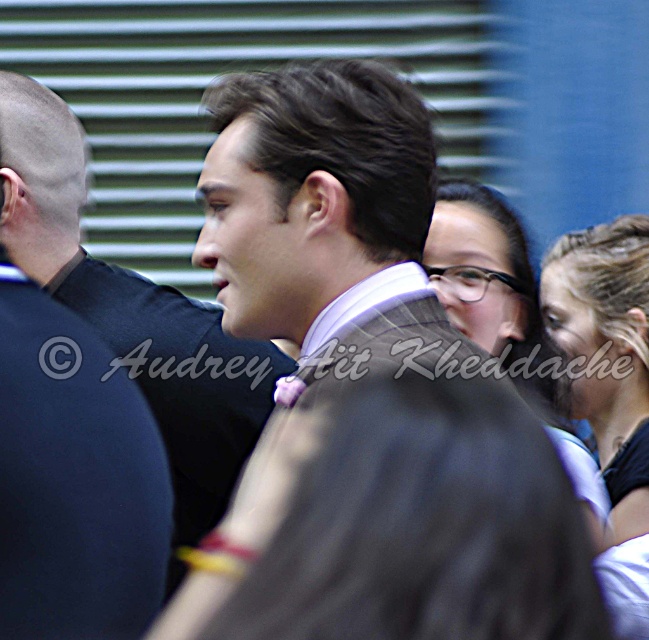
Is point (8, 220) positioned before point (546, 404)?

Yes, it is in front of point (546, 404).

Identify the location of matte gray suit at center. The width and height of the screenshot is (649, 640). (132, 310).

Find the location of `matte gray suit at center`. matte gray suit at center is located at coordinates (132, 310).

Does matte gray suit at center have a greater height compared to blonde hair at center?

Indeed, matte gray suit at center has a greater height compared to blonde hair at center.

Who is more forward, (x=69, y=128) or (x=622, y=467)?

Positioned in front is point (x=69, y=128).

This screenshot has width=649, height=640. Find the location of `matte gray suit at center`. matte gray suit at center is located at coordinates (132, 310).

Does satin brown suit at center appear over blonde hair at center?

Indeed, satin brown suit at center is positioned over blonde hair at center.

Which is behind, point (434, 420) or point (644, 472)?

The point (644, 472) is more distant.

Where is `satin brown suit at center`? Image resolution: width=649 pixels, height=640 pixels. satin brown suit at center is located at coordinates (365, 394).

Locate an element on the screen. The height and width of the screenshot is (640, 649). satin brown suit at center is located at coordinates (365, 394).